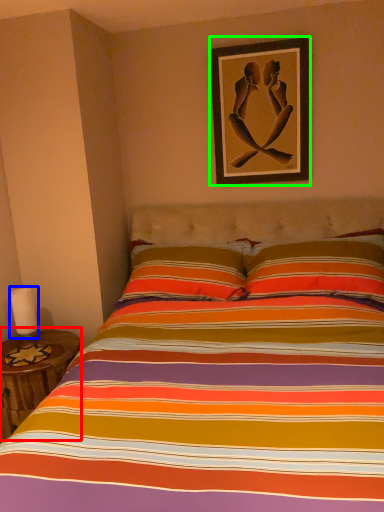
Question: Which is farther away from table (highlighted by a red box)? candle (highlighted by a blue box) or picture frame (highlighted by a green box)?

Choices:
 (A) candle
 (B) picture frame

Answer: (B)